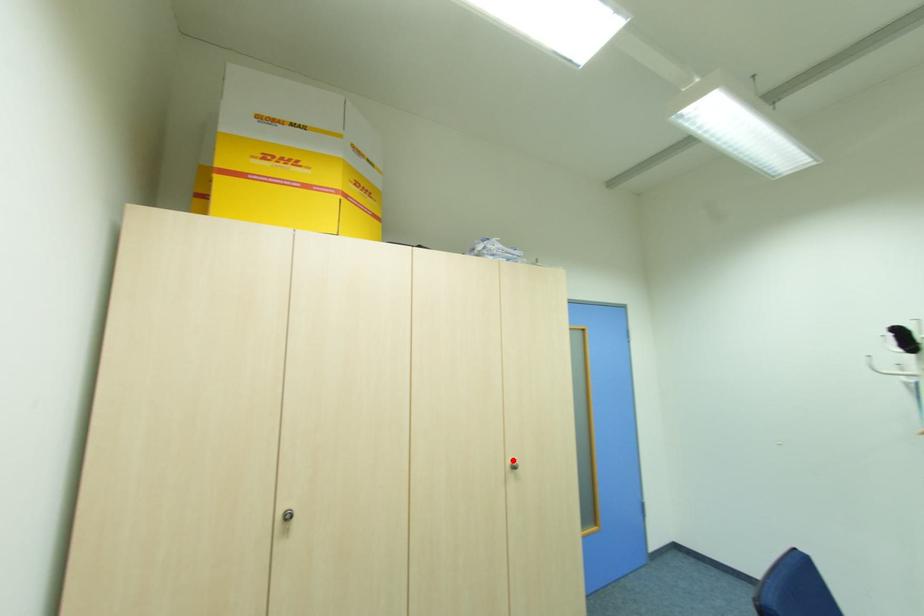
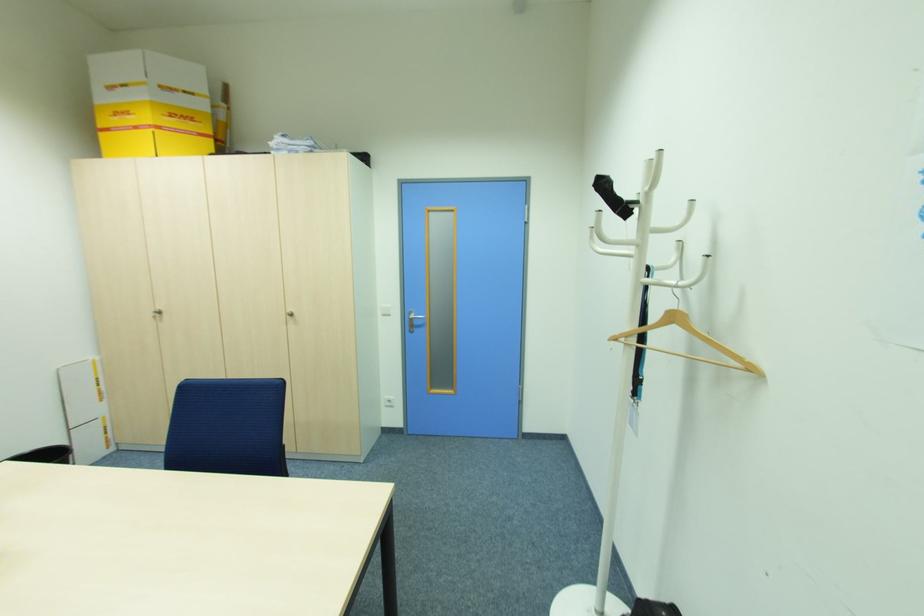
Locate, in the second image, the point that corresponds to the highlighted location in the first image.

(292, 310)